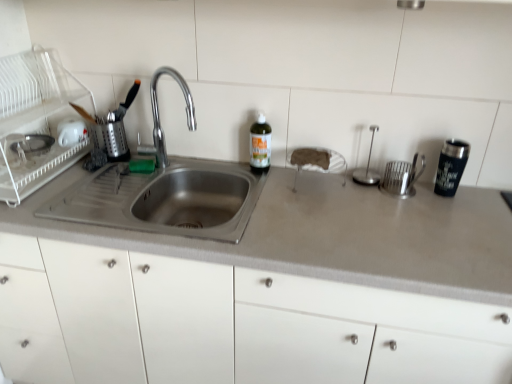
Where is `space that is in front of green glass bottle at center`? Image resolution: width=512 pixels, height=384 pixels. space that is in front of green glass bottle at center is located at coordinates (273, 191).